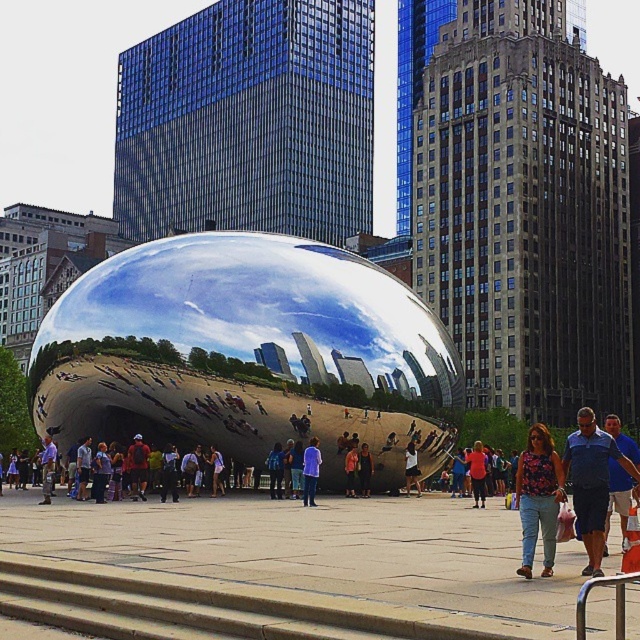
Question: Which of these objects is positioned closest to the blue shirt at center?

Choices:
 (A) denim pants at center
 (B) denim jacket at center

Answer: (B)

Question: Among these objects, which one is nearest to the camera?

Choices:
 (A) purple fabric shirt at center
 (B) denim pants at center
 (C) denim shorts at center

Answer: (A)

Question: Does denim jacket at lower left have a smaller size compared to denim jacket at center?

Choices:
 (A) no
 (B) yes

Answer: (A)

Question: Which object appears farthest from the camera in this image?

Choices:
 (A) floral print shirt at center
 (B) blue fabric shirt at center
 (C) blue denim shorts at lower right

Answer: (B)

Question: Is purple fabric shirt at center to the left of denim jacket at lower left from the viewer's perspective?

Choices:
 (A) no
 (B) yes

Answer: (A)

Question: Is blue shirt at center to the right of orange t-shirt at center from the viewer's perspective?

Choices:
 (A) no
 (B) yes

Answer: (B)